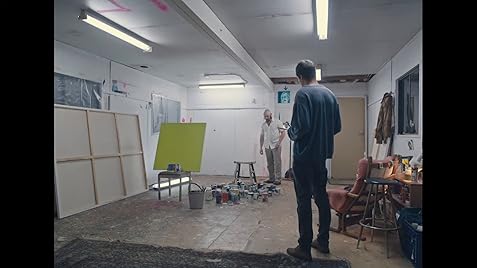
Locate an element on the screen. rug is located at coordinates (180, 258).